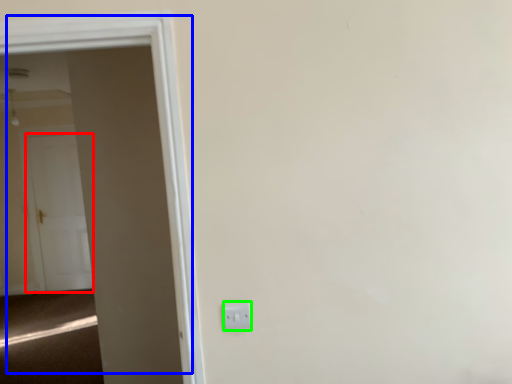
Question: Which object is the closest to the door (highlighted by a red box)? Choose among these: door (highlighted by a blue box) or electric outlet (highlighted by a green box).

Choices:
 (A) door
 (B) electric outlet

Answer: (A)